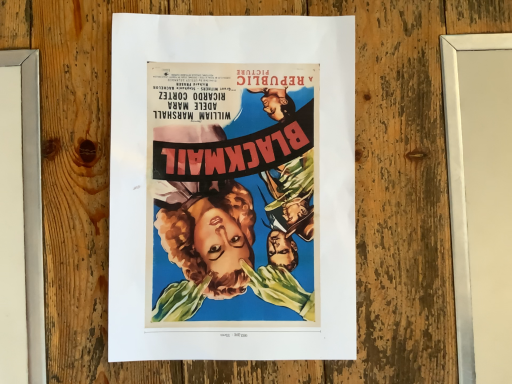
Where is `matte paper poster at center`? matte paper poster at center is located at coordinates (232, 188).

Describe the element at coordinates (232, 188) in the screenshot. I see `matte paper poster at center` at that location.

Image resolution: width=512 pixels, height=384 pixels. In order to click on matte paper poster at center in this screenshot , I will do `click(232, 188)`.